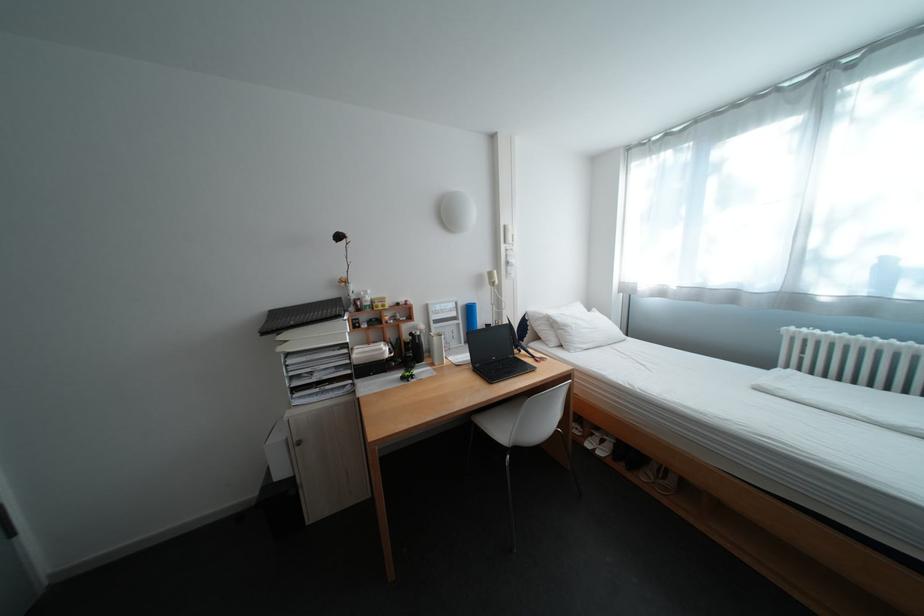
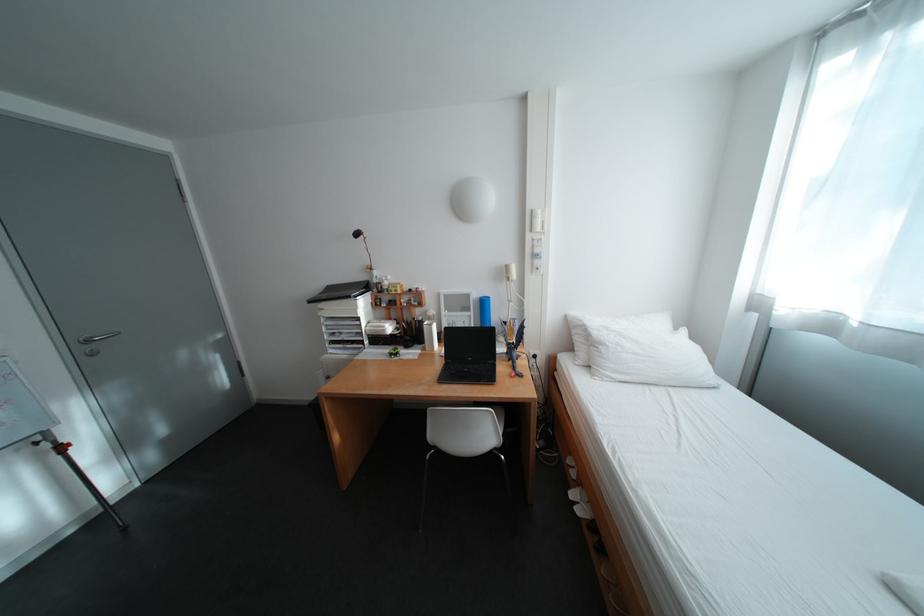
Find the pixel in the second image that matches point 517,228 in the first image.

(544, 213)